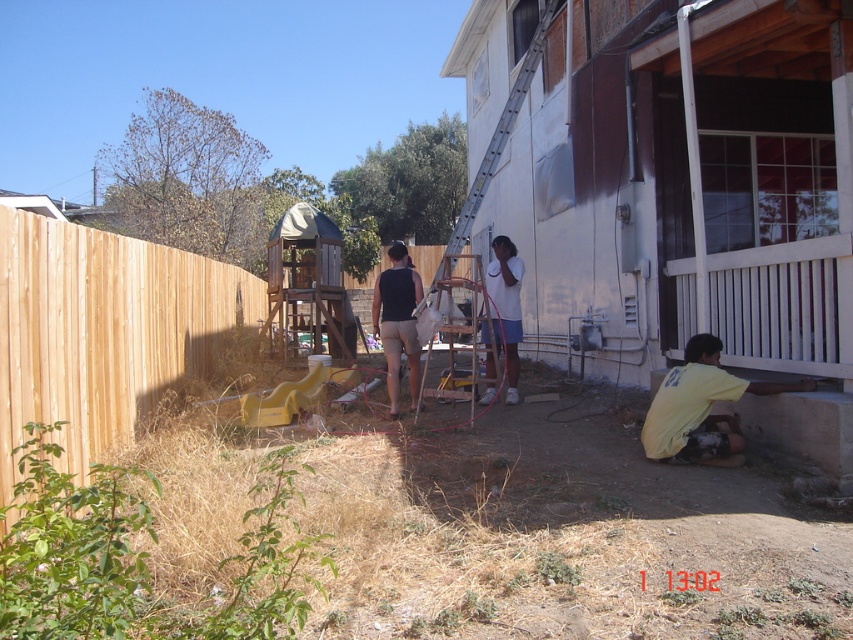
Is brown wood fence at left smaller than matte black tank top at center?

Yes, brown wood fence at left is smaller than matte black tank top at center.

From the picture: Who is positioned more to the left, brown wood fence at left or matte black tank top at center?

Positioned to the left is brown wood fence at left.

What do you see at coordinates (103, 332) in the screenshot?
I see `brown wood fence at left` at bounding box center [103, 332].

Locate an element on the screen. Image resolution: width=853 pixels, height=640 pixels. brown wood fence at left is located at coordinates pos(103,332).

Is metallic silver ladder at center to the right of white matte shirt at center from the viewer's perspective?

Indeed, metallic silver ladder at center is positioned on the right side of white matte shirt at center.

Looking at this image, which of these two, metallic silver ladder at center or white matte shirt at center, stands taller?

metallic silver ladder at center

The image size is (853, 640). In order to click on metallic silver ladder at center in this screenshot , I will do `click(497, 141)`.

Does brown wood fence at left appear on the right side of metallic silver ladder at center?

In fact, brown wood fence at left is to the left of metallic silver ladder at center.

Does brown wood fence at left have a lesser height compared to metallic silver ladder at center?

Yes, brown wood fence at left is shorter than metallic silver ladder at center.

Measure the distance between point [262,282] and camera.

They are 20.27 meters apart.

You are a GUI agent. You are given a task and a screenshot of the screen. Output one action in this format:
    pyautogui.click(x=<x>, y=<y>)
    Task: Click on the brown wood fence at left
    This screenshot has width=853, height=640.
    Given the screenshot: What is the action you would take?
    pyautogui.click(x=103, y=332)